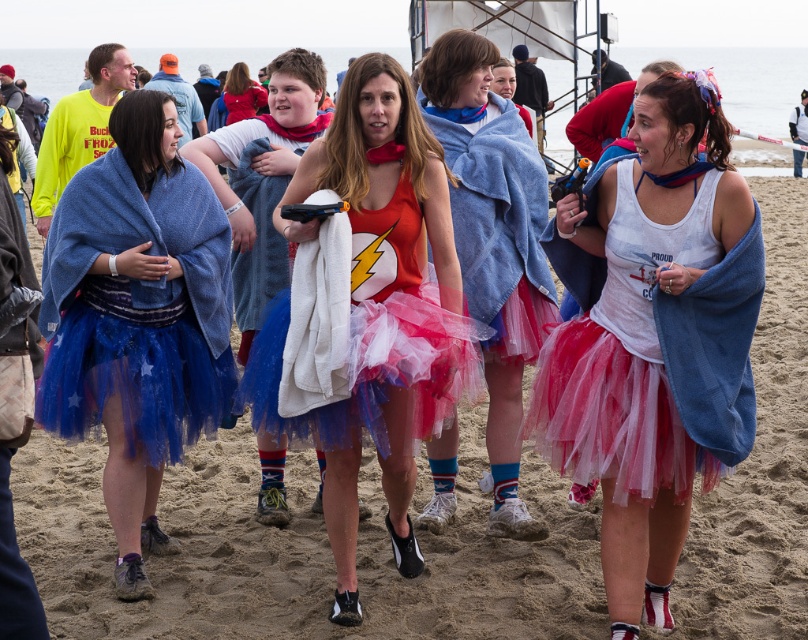
Is point (562, 541) less distant than point (671, 573)?

That is False.

Does sandy beach at center lie in front of white cotton tank top at center?

Answer: No, it is behind white cotton tank top at center.

Who is more distant from viewer, (756,586) or (682,310)?

Positioned behind is point (756,586).

Where is `sandy beach at center`? sandy beach at center is located at coordinates (301, 552).

Which is above, blue tulle skirt at left or matte blue towel at center?

matte blue towel at center is above.

Does blue tulle skirt at left have a greater width compared to matte blue towel at center?

Yes.

Is point (120, 273) closer to viewer compared to point (501, 236)?

Yes.

Locate an element on the screen. blue tulle skirt at left is located at coordinates (137, 317).

Is sandy beach at center to the left of matte blue towel at center from the viewer's perspective?

Yes, sandy beach at center is to the left of matte blue towel at center.

What do you see at coordinates (301, 552) in the screenshot?
I see `sandy beach at center` at bounding box center [301, 552].

Is point (40, 592) less distant than point (503, 192)?

Yes, point (40, 592) is in front of point (503, 192).

Locate an element on the screen. sandy beach at center is located at coordinates (301, 552).